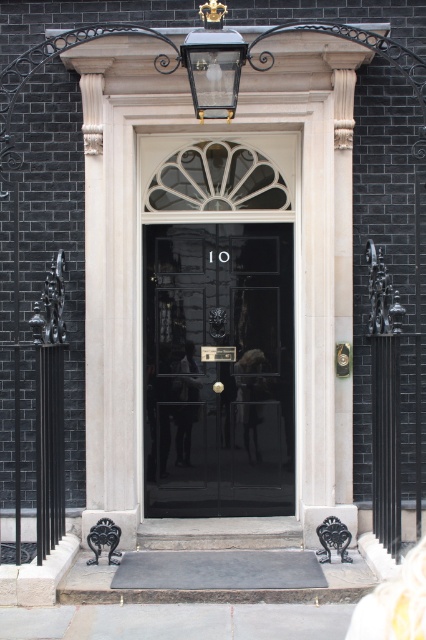
I want to click on glossy black door at center, so click(x=218, y=369).

Is the position of glossy black door at center more distant than that of clear glass lantern at upper center?

That is True.

Describe the element at coordinates (218, 369) in the screenshot. This screenshot has height=640, width=426. I see `glossy black door at center` at that location.

Locate an element on the screen. The height and width of the screenshot is (640, 426). glossy black door at center is located at coordinates (218, 369).